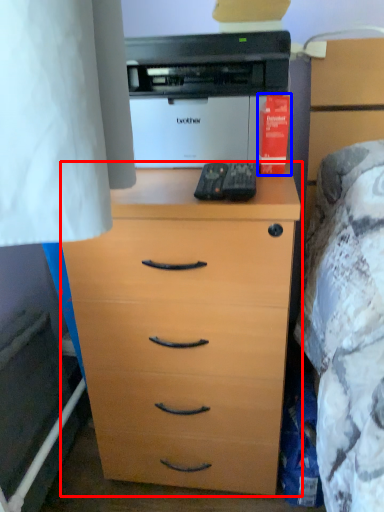
Question: Among these objects, which one is nearest to the camera, chest of drawers (highlighted by a red box) or book (highlighted by a blue box)?

Choices:
 (A) chest of drawers
 (B) book

Answer: (A)